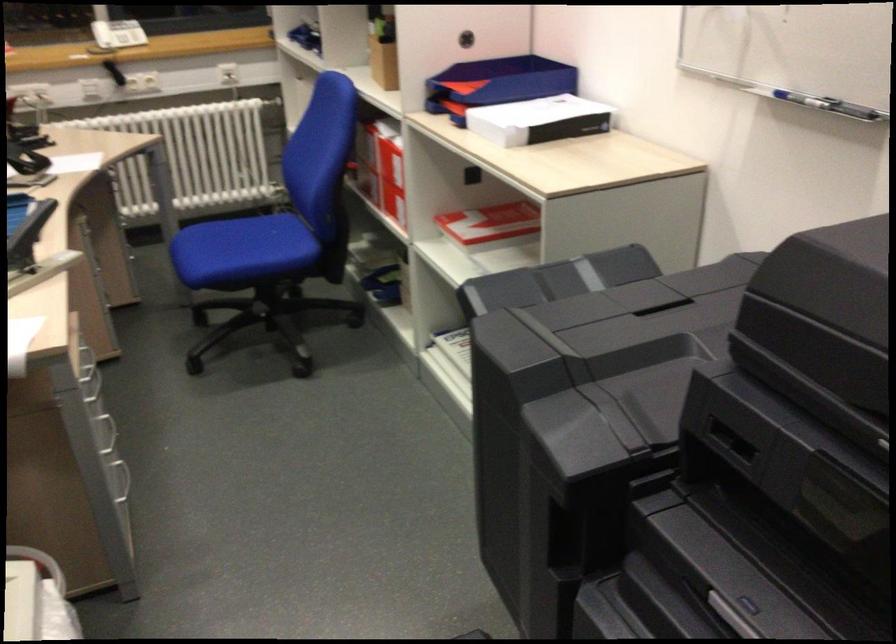
The height and width of the screenshot is (644, 896). Find the location of `whiteboard marker`. whiteboard marker is located at coordinates (820, 102).